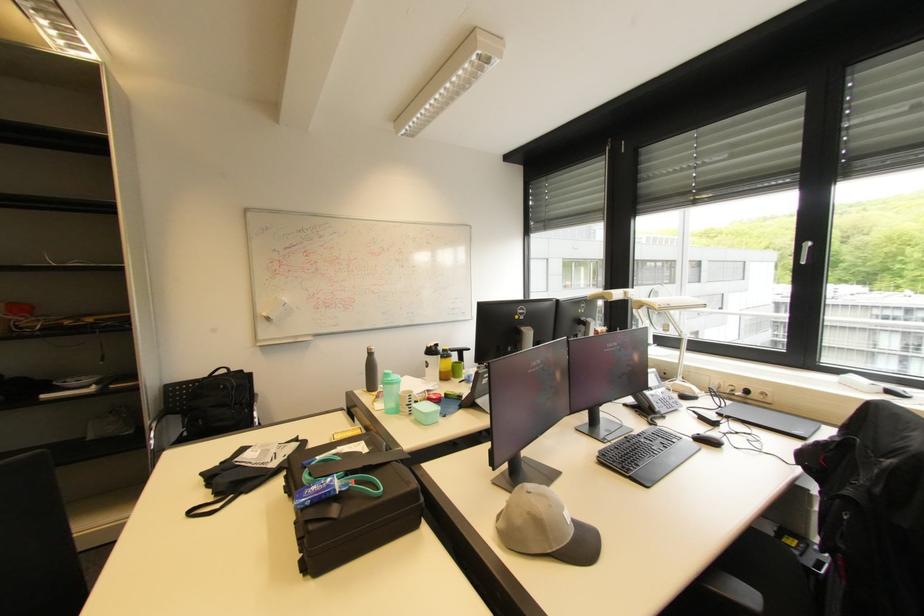
Image resolution: width=924 pixels, height=616 pixels. Describe the element at coordinates (805, 252) in the screenshot. I see `a white window handle` at that location.